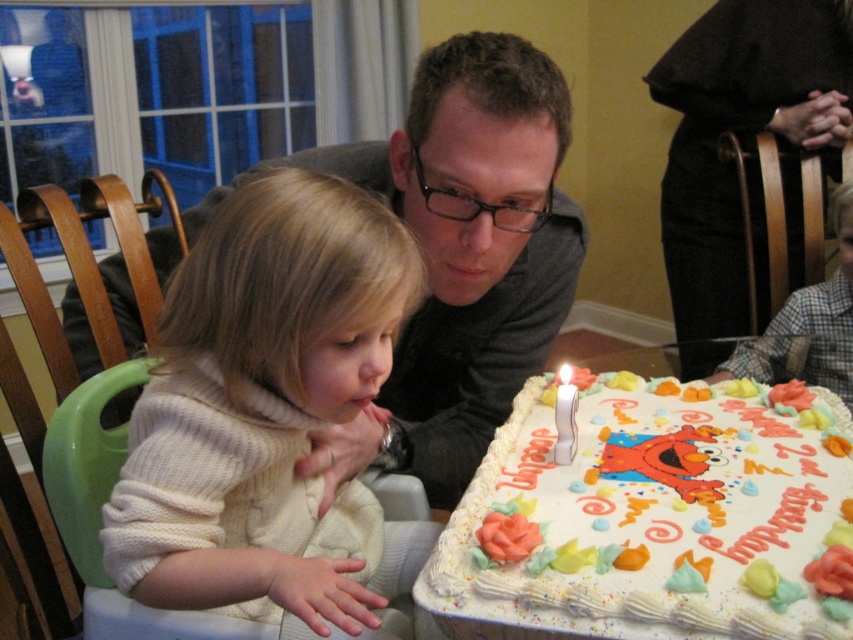
Is white frosted cake at center in front of matte gray shirt at upper center?

Yes, it is in front of matte gray shirt at upper center.

Who is positioned more to the left, white frosted cake at center or matte gray shirt at upper center?

Positioned to the left is white frosted cake at center.

The width and height of the screenshot is (853, 640). I want to click on white frosted cake at center, so click(x=645, y=520).

Can you confirm if matte gray shirt at center is positioned above plaid shirt at lower right?

No, matte gray shirt at center is not above plaid shirt at lower right.

Is matte gray shirt at center taller than plaid shirt at lower right?

Yes.

Image resolution: width=853 pixels, height=640 pixels. What do you see at coordinates (459, 256) in the screenshot?
I see `matte gray shirt at center` at bounding box center [459, 256].

The image size is (853, 640). In order to click on matte gray shirt at center in this screenshot , I will do `click(459, 256)`.

Between point (421, 362) and point (685, 376), which one is positioned behind?

The point (685, 376) is behind.

How far apart are matte gray shirt at center and matte gray shirt at upper center?

A distance of 1.19 meters exists between matte gray shirt at center and matte gray shirt at upper center.

Between point (467, 296) and point (685, 230), which one is positioned behind?

Point (685, 230)

Locate an element on the screen. matte gray shirt at center is located at coordinates (459, 256).